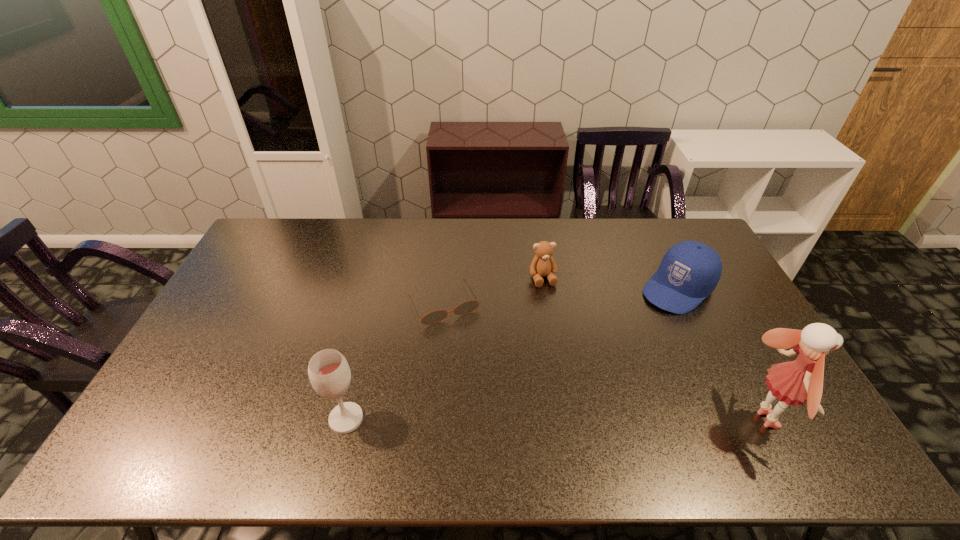
Find the location of a particular element. The height and width of the screenshot is (540, 960). free area in between the sunglasses and the wineglass is located at coordinates (395, 361).

Locate an element on the screen. The height and width of the screenshot is (540, 960). free point between the cap and the tallest object is located at coordinates (720, 354).

I want to click on free space between the shortest object and the fourth shortest object, so click(395, 361).

Locate an element on the screen. The width and height of the screenshot is (960, 540). blank region between the tallest object and the sunglasses is located at coordinates (603, 362).

Image resolution: width=960 pixels, height=540 pixels. Identify the location of vacant space that's between the wineglass and the sunglasses. [395, 361].

Identify the location of free space between the shortest object and the cap. (561, 296).

This screenshot has height=540, width=960. Find the location of `vacant point located between the fourth shortest object and the doll`. vacant point located between the fourth shortest object and the doll is located at coordinates (554, 419).

You are a GUI agent. You are given a task and a screenshot of the screen. Output one action in this format:
    pyautogui.click(x=<x>, y=<y>)
    Task: Click on the free point between the cap and the doll
    The height and width of the screenshot is (540, 960).
    Given the screenshot: What is the action you would take?
    pyautogui.click(x=720, y=354)

Identify which object is the third nearest to the teddy bear. Please provide its 2D coordinates. Your answer should be formatted as a tuple, i.e. [(x, y)], where the tuple contains the x and y coordinates of a point satisfying the conditions above.

[(795, 382)]

Where is `object that is the third closest one to the cap`? The width and height of the screenshot is (960, 540). object that is the third closest one to the cap is located at coordinates (437, 316).